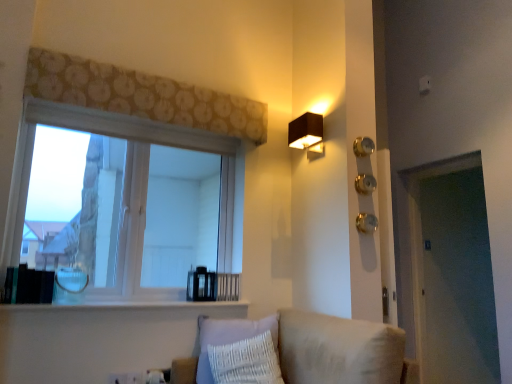
Describe the element at coordinates (362, 146) in the screenshot. I see `gold metallic knob at right, which is the third knob in bottom-to-top order` at that location.

Locate an element on the screen. white plastic electric outlet at lower left, which is counted as the first electric outlet, starting from the left is located at coordinates (118, 378).

What is the approximate width of gold metallic knob at right, the second knob in the top-to-bottom sequence?

It is 3.24 inches.

What do you see at coordinates (365, 184) in the screenshot?
I see `gold metallic knob at right, which is the second knob in bottom-to-top order` at bounding box center [365, 184].

Image resolution: width=512 pixels, height=384 pixels. Describe the element at coordinates (306, 132) in the screenshot. I see `black matte rectangular lamp at upper right` at that location.

Where is `white plastic electric outlet at lower center, which ranks as the second electric outlet in left-to-right order`? white plastic electric outlet at lower center, which ranks as the second electric outlet in left-to-right order is located at coordinates (134, 377).

Describe the element at coordinates (134, 377) in the screenshot. I see `white plastic electric outlet at lower center, which ranks as the second electric outlet in left-to-right order` at that location.

Find the location of `gold metallic knob at right, the 1th knob positioned from the top`. gold metallic knob at right, the 1th knob positioned from the top is located at coordinates (362, 146).

Which of these two, patterned fabric curtain at upper center or white glossy window sill at lower center, is wider?

→ white glossy window sill at lower center is wider.

Choose the correct answer: Is patterned fabric curtain at upper center inside white glossy window sill at lower center or outside it?

patterned fabric curtain at upper center lies outside white glossy window sill at lower center.

Is there a large distance between patterned fabric curtain at upper center and white glossy window sill at lower center?

Yes.

Between patterned fabric curtain at upper center and white glossy window sill at lower center, which one appears on the left side from the viewer's perspective?

Positioned to the left is white glossy window sill at lower center.

Which object is thinner, white plastic electric outlet at lower left, the second electric outlet when ordered from right to left, or gold metallic knob at right, the second knob in the top-to-bottom sequence?

white plastic electric outlet at lower left, the second electric outlet when ordered from right to left, is thinner.

From a real-world perspective, who is located higher, white plastic electric outlet at lower left, which is counted as the first electric outlet, starting from the left, or gold metallic knob at right, which is the second knob in bottom-to-top order?

In real-world perspective, gold metallic knob at right, which is the second knob in bottom-to-top order, is above.

Measure the distance between white plastic electric outlet at lower left, which is counted as the first electric outlet, starting from the left, and gold metallic knob at right, the second knob in the top-to-bottom sequence.

white plastic electric outlet at lower left, which is counted as the first electric outlet, starting from the left, is 1.86 meters from gold metallic knob at right, the second knob in the top-to-bottom sequence.

From the image's perspective, is white plastic electric outlet at lower left, the second electric outlet when ordered from right to left, above or below gold metallic knob at right, the second knob in the top-to-bottom sequence?

Clearly, from the image's perspective, white plastic electric outlet at lower left, the second electric outlet when ordered from right to left, is below gold metallic knob at right, the second knob in the top-to-bottom sequence.

Does patterned fabric curtain at upper center lie behind black matte rectangular lamp at upper right?

No.

Locate an element on the screen. The height and width of the screenshot is (384, 512). curtain above the black matte rectangular lamp at upper right (from a real-world perspective) is located at coordinates (142, 95).

Is point (190, 92) less distant than point (305, 113)?

Yes, point (190, 92) is in front of point (305, 113).

Considering the relative sizes of patterned fabric curtain at upper center and black matte rectangular lamp at upper right in the image provided, is patterned fabric curtain at upper center thinner than black matte rectangular lamp at upper right?

Yes.

Which is behind, point (225, 190) or point (218, 303)?

The point (225, 190) is farther.

Does white wood window at upper left come behind white glossy window sill at lower center?

Yes, white wood window at upper left is behind white glossy window sill at lower center.

Where is `window sill located on the right of white wood window at upper left`? Image resolution: width=512 pixels, height=384 pixels. window sill located on the right of white wood window at upper left is located at coordinates (123, 306).

Can you confirm if white wood window at upper left is taller than white plastic electric outlet at lower left, the second electric outlet when ordered from right to left?

Yes, white wood window at upper left is taller than white plastic electric outlet at lower left, the second electric outlet when ordered from right to left.

Is white wood window at upper left positioned behind white plastic electric outlet at lower left, the second electric outlet when ordered from right to left?

That is False.

Which of these two, white wood window at upper left or white plastic electric outlet at lower left, the second electric outlet when ordered from right to left, is thinner?

With smaller width is white plastic electric outlet at lower left, the second electric outlet when ordered from right to left.

Considering the points (126, 193) and (113, 374), which point is behind, point (126, 193) or point (113, 374)?

The point (126, 193) is farther.

In terms of height, does gold metallic knob at right, the second knob in the top-to-bottom sequence, look taller or shorter compared to patterned fabric curtain at upper center?

gold metallic knob at right, the second knob in the top-to-bottom sequence, is shorter than patterned fabric curtain at upper center.

The image size is (512, 384). In the image, there is a gold metallic knob at right, which is the second knob in bottom-to-top order. What are the coordinates of `curtain above it (from the image's perspective)` in the screenshot? It's located at (142, 95).

Image resolution: width=512 pixels, height=384 pixels. What are the coordinates of `window sill to the left of gold metallic knob at right, the second knob in the top-to-bottom sequence` in the screenshot? It's located at (123, 306).

Which is behind, gold metallic knob at right, which is the second knob in bottom-to-top order, or white glossy window sill at lower center?

gold metallic knob at right, which is the second knob in bottom-to-top order, is further away from the camera.

Based on the photo, is gold metallic knob at right, which is the second knob in bottom-to-top order, to the right of white glossy window sill at lower center from the viewer's perspective?

Yes, gold metallic knob at right, which is the second knob in bottom-to-top order, is to the right of white glossy window sill at lower center.

From the image's perspective, which one is positioned lower, gold metallic knob at right, which is the second knob in bottom-to-top order, or white glossy window sill at lower center?

white glossy window sill at lower center appears lower in the image.

Where is `curtain above the white glossy window sill at lower center (from the image's perspective)`? Image resolution: width=512 pixels, height=384 pixels. curtain above the white glossy window sill at lower center (from the image's perspective) is located at coordinates (142, 95).

From a real-world perspective, which electric outlet is the 1st one underneath the gold metallic knob at right, which is the second knob in bottom-to-top order? Please provide its 2D coordinates.

[(118, 378)]

From the picture: From the image, which object appears to be farther from white wood window at upper left, patterned fabric curtain at upper center or gold metallic knob at right, the 1th knob positioned from the top?

gold metallic knob at right, the 1th knob positioned from the top.

Looking at the image, which one is located closer to patterned fabric curtain at upper center, beige fabric couch at lower center or black matte rectangular lamp at upper right?

Among the two, black matte rectangular lamp at upper right is located nearer to patterned fabric curtain at upper center.

When comparing their distances from white plastic electric outlet at lower left, which is counted as the first electric outlet, starting from the left, does white glossy window sill at lower center or white wood window at upper left seem closer?

Based on the image, white glossy window sill at lower center appears to be nearer to white plastic electric outlet at lower left, which is counted as the first electric outlet, starting from the left.

Looking at the image, which one is located closer to white wood window at upper left, gold metallic knob at right, the 1th knob positioned from the top, or white plastic electric outlet at lower left, which is counted as the first electric outlet, starting from the left?

The object closer to white wood window at upper left is white plastic electric outlet at lower left, which is counted as the first electric outlet, starting from the left.

From the image, which object appears to be nearer to gold metallic knob at right, the 1th knob positioned from the top, black matte rectangular lamp at upper right or gold metallic knob at right, the second knob in the top-to-bottom sequence?

gold metallic knob at right, the second knob in the top-to-bottom sequence, is closer to gold metallic knob at right, the 1th knob positioned from the top.

From the image, which object appears to be nearer to black matte rectangular lamp at upper right, gold metallic knob at right, which is the third knob in bottom-to-top order, or white plastic electric outlet at lower center, which ranks as the second electric outlet in left-to-right order?

gold metallic knob at right, which is the third knob in bottom-to-top order, is closer to black matte rectangular lamp at upper right.

Estimate the real-world distances between objects in this image. Which object is closer to white plastic electric outlet at lower left, which is counted as the first electric outlet, starting from the left, white wood window at upper left or patterned fabric curtain at upper center?

Among the two, white wood window at upper left is located nearer to white plastic electric outlet at lower left, which is counted as the first electric outlet, starting from the left.

From the image, which object appears to be nearer to black matte rectangular lamp at upper right, white glossy window sill at lower center or white plastic electric outlet at lower left, which is counted as the first electric outlet, starting from the left?

white glossy window sill at lower center is positioned closer to the anchor black matte rectangular lamp at upper right.

At what (x,y) coordinates should I click in order to perform the action: click on knob between white glossy window sill at lower center and gold metallic knob at right, the first knob positioned from the bottom. Please return your answer as a coordinate pair (x, y). Looking at the image, I should click on (362, 146).

I want to click on lamp between white plastic electric outlet at lower left, which is counted as the first electric outlet, starting from the left, and gold metallic knob at right, the third knob in the top-to-bottom sequence, so click(306, 132).

Where is `studio couch situated between white plastic electric outlet at lower center, the first electric outlet positioned from the right, and gold metallic knob at right, the second knob in the top-to-bottom sequence, from left to right`? studio couch situated between white plastic electric outlet at lower center, the first electric outlet positioned from the right, and gold metallic knob at right, the second knob in the top-to-bottom sequence, from left to right is located at coordinates (338, 349).

Locate an element on the screen. The image size is (512, 384). electric outlet between white wood window at upper left and gold metallic knob at right, the first knob positioned from the bottom is located at coordinates (134, 377).